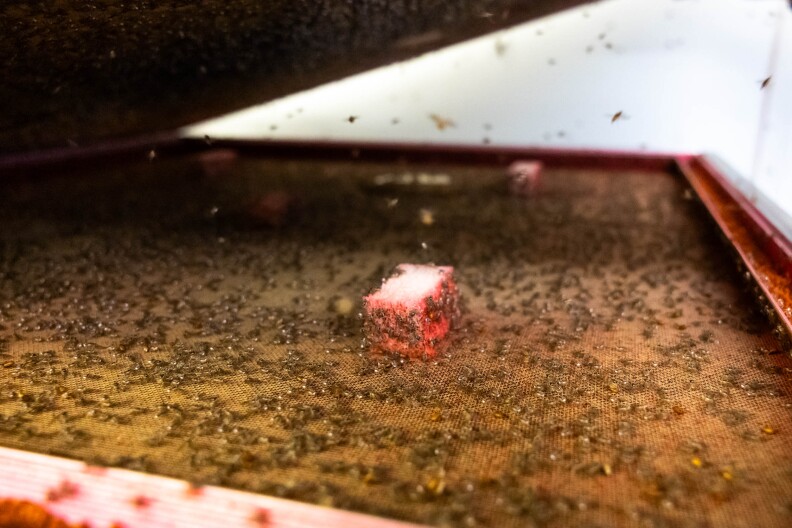
At what (x,y) coordinates should I click in order to perform the action: click on white trim. Please return your answer as a coordinate pair (x, y). The width and height of the screenshot is (792, 528). Looking at the image, I should click on (117, 497).